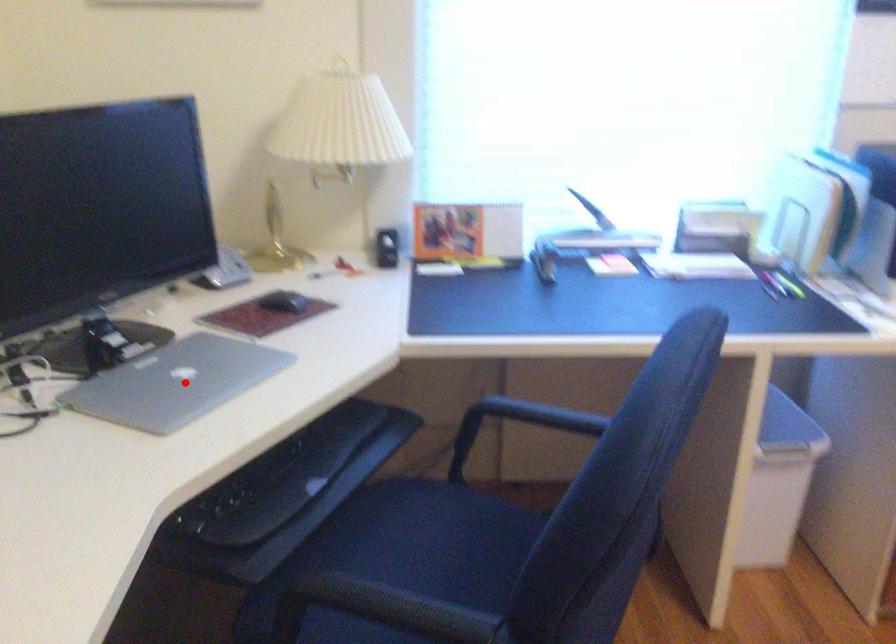
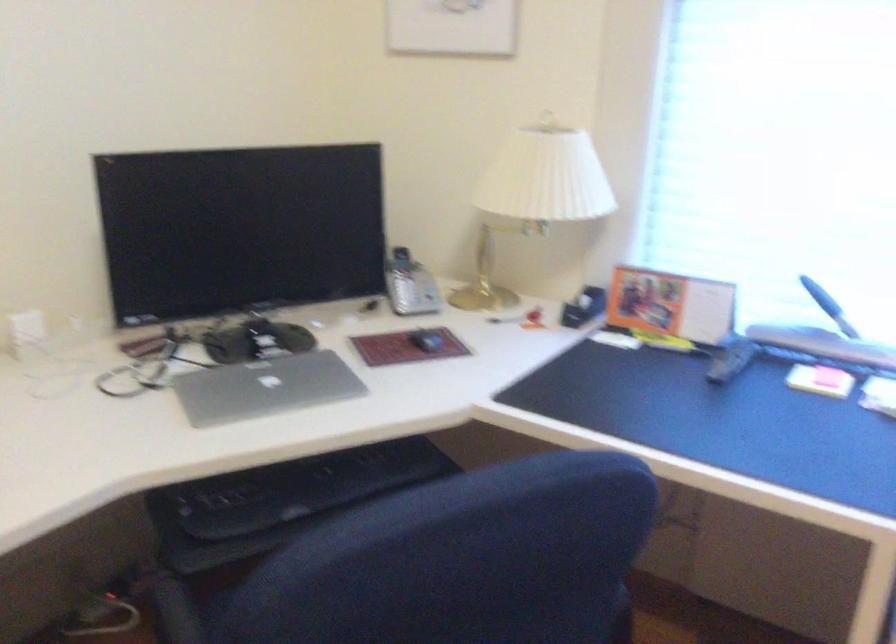
Question: I am providing you with two images of the same scene from different viewpoints. Image1 has a red point marked. In image2, the corresponding 3D location appears at what relative position? Reply with the corresponding letter.

Choices:
 (A) Closer
 (B) Farther

Answer: (B)